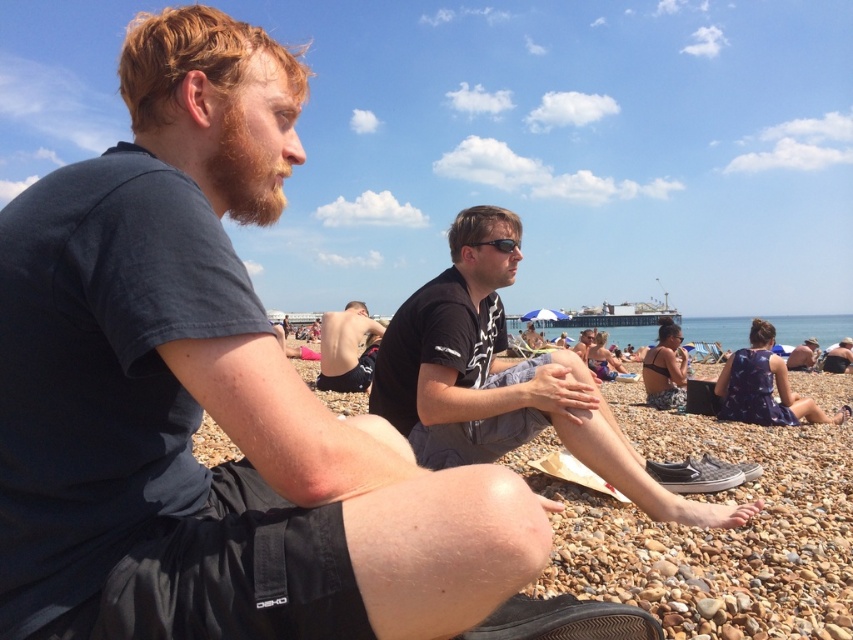
You are trying to place the matte black phone at center into a small pouch that can only hold items thinner than the dark blue fabric shirt at lower right. Can the phone fit?

The matte black phone at center is thinner than the dark blue fabric shirt at lower right, so it can fit into the pouch.